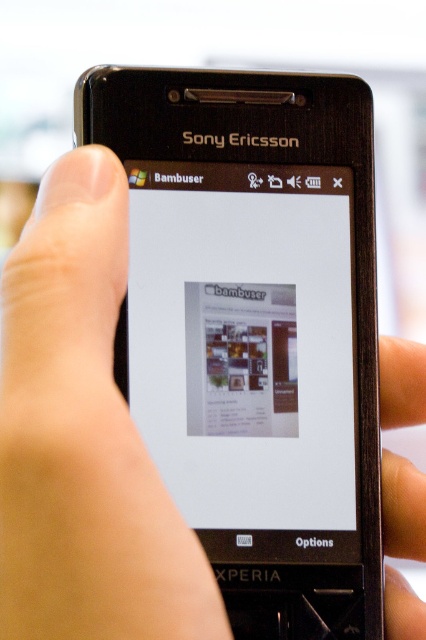
Measure the distance from white glossy screen at center to skinny metallic finger at upper right.

white glossy screen at center is 3.29 inches away from skinny metallic finger at upper right.

Between point (316, 243) and point (382, 426), which one is positioned in front?

Point (316, 243) is more forward.

Locate an element on the screen. This screenshot has height=640, width=426. white glossy screen at center is located at coordinates (244, 340).